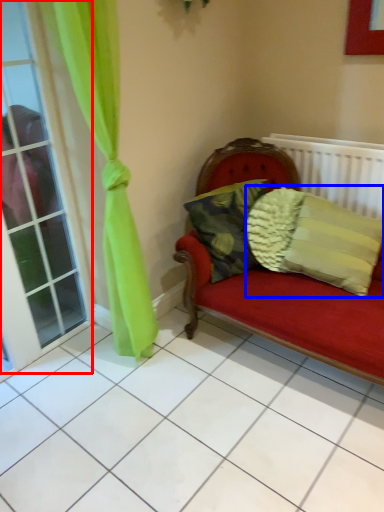
Question: Which object is closer to the camera taking this photo, window (highlighted by a red box) or pillow (highlighted by a blue box)?

Choices:
 (A) window
 (B) pillow

Answer: (A)